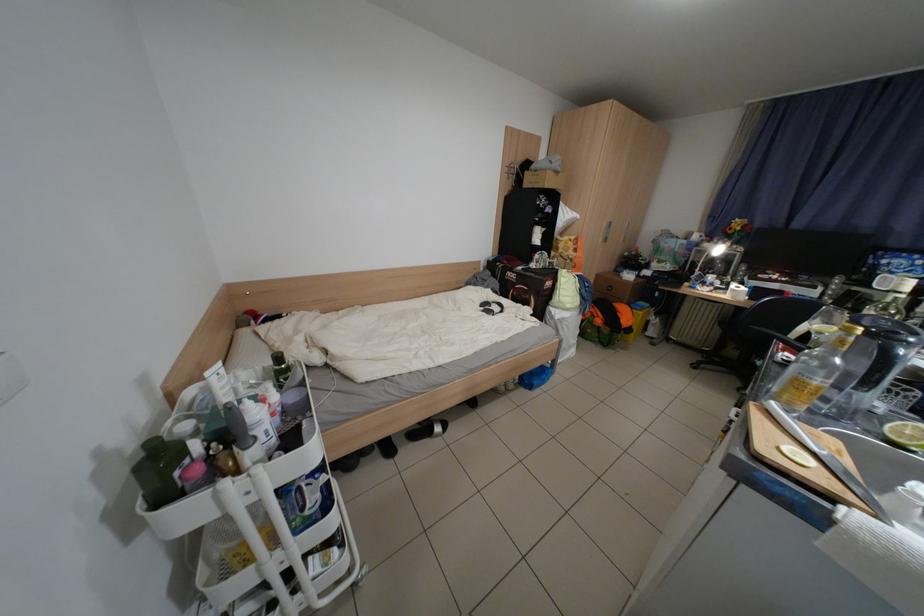
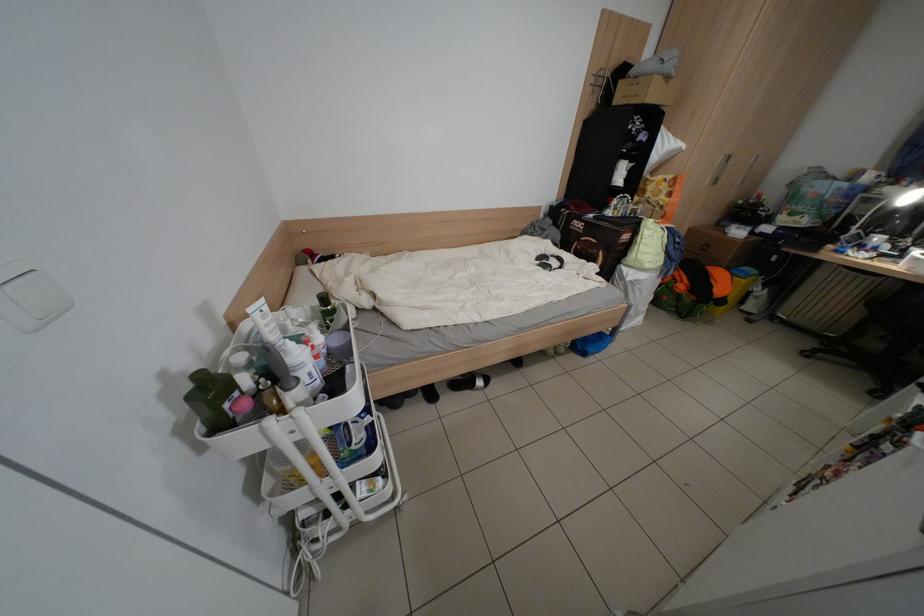
The point at (225, 379) is marked in the first image. Where is the corresponding point in the second image?

(268, 317)